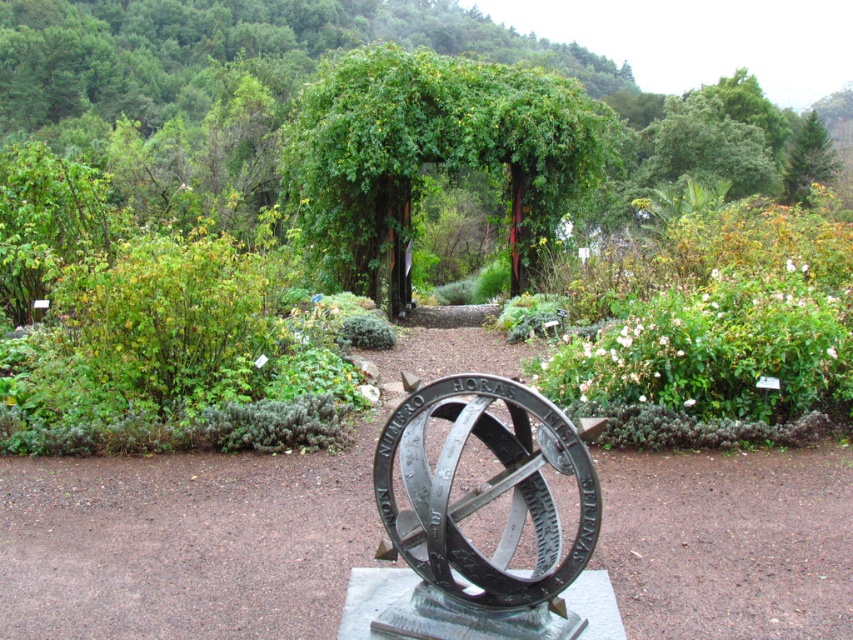
Is green leafy tree at center below green leafy bush at left?

No, green leafy tree at center is not below green leafy bush at left.

Is green leafy tree at center further to the viewer compared to green leafy bush at left?

Yes, it is.

Which is behind, point (440, 58) or point (204, 337)?

Point (440, 58)

This screenshot has width=853, height=640. What are the coordinates of `green leafy tree at center` in the screenshot? It's located at (432, 154).

Can you confirm if green leafy tree at center is positioned to the right of bronze sundial at center?

Correct, you'll find green leafy tree at center to the right of bronze sundial at center.

Can you confirm if green leafy tree at center is shorter than bronze sundial at center?

Indeed, green leafy tree at center has a lesser height compared to bronze sundial at center.

Is point (404, 172) closer to camera compared to point (538, 458)?

No, (404, 172) is further to viewer.

Where is `green leafy tree at center`? green leafy tree at center is located at coordinates (432, 154).

Who is positioned more to the right, bronze sundial at center or green leafy bush at left?

Positioned to the right is bronze sundial at center.

Consider the image. Who is shorter, bronze sundial at center or green leafy bush at left?

Standing shorter between the two is bronze sundial at center.

Is point (560, 417) farther from viewer compared to point (222, 273)?

No, (560, 417) is closer to viewer.

Locate an element on the screen. The width and height of the screenshot is (853, 640). bronze sundial at center is located at coordinates (479, 508).